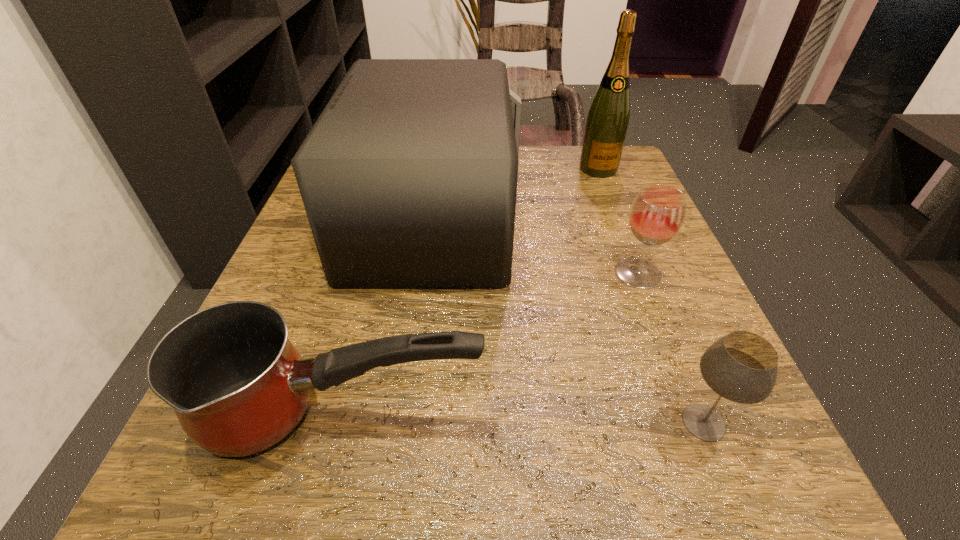
Where is `wine bottle present at the far edge`? The height and width of the screenshot is (540, 960). wine bottle present at the far edge is located at coordinates (607, 122).

Locate an element on the screen. The height and width of the screenshot is (540, 960). microwave oven that is at the far edge is located at coordinates (408, 177).

Locate an element on the screen. The width and height of the screenshot is (960, 540). saucepan that is at the near edge is located at coordinates (237, 385).

Identify the location of wineglass that is at the near edge. Image resolution: width=960 pixels, height=540 pixels. (742, 367).

This screenshot has width=960, height=540. I want to click on microwave oven at the left edge, so click(408, 177).

The width and height of the screenshot is (960, 540). I want to click on saucepan that is positioned at the left edge, so 237,385.

Where is `wine bottle at the right edge`? The height and width of the screenshot is (540, 960). wine bottle at the right edge is located at coordinates (607, 122).

Where is `object that is at the far left corner`? This screenshot has height=540, width=960. object that is at the far left corner is located at coordinates (408, 177).

At what (x,y) coordinates should I click in order to perform the action: click on object located in the near left corner section of the desktop. Please return your answer as a coordinate pair (x, y). Looking at the image, I should click on (x=237, y=385).

Where is `object at the far right corner`? This screenshot has height=540, width=960. object at the far right corner is located at coordinates (607, 122).